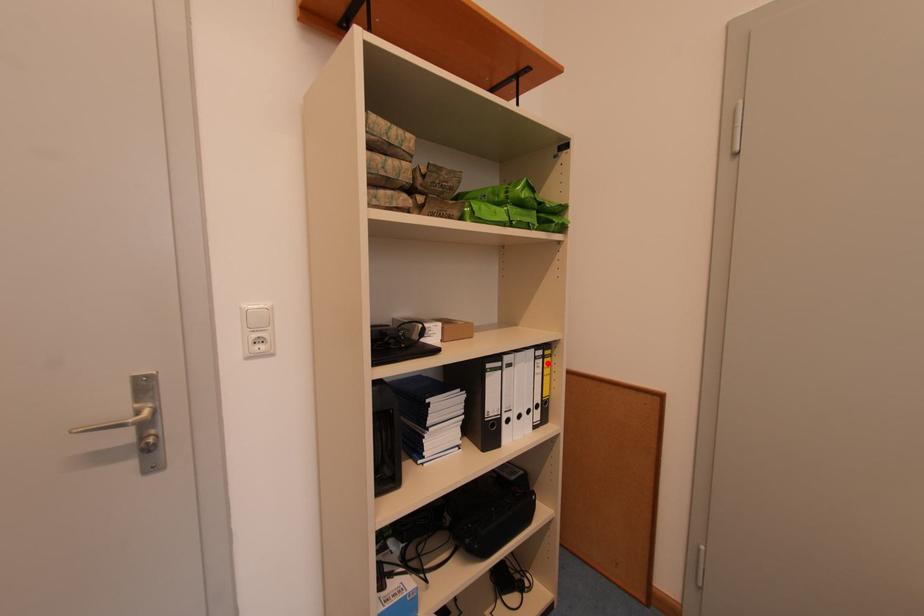
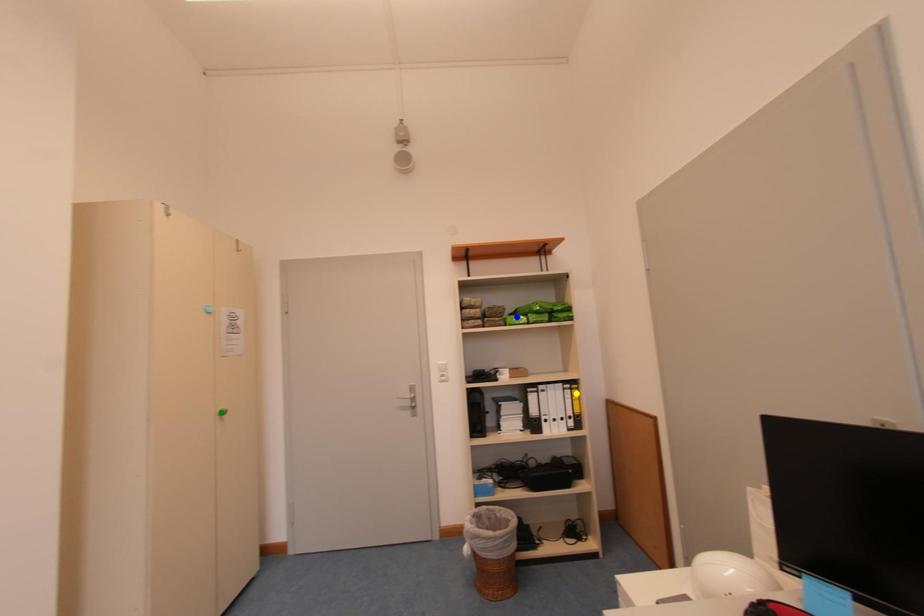
Question: I am providing you with two images of the same scene from different viewpoints. A red point is marked on the first image. You are given multiple points on the second image. Which point in image 2 represents the same 3d spot as the red point in image 1?

Choices:
 (A) green point
 (B) blue point
 (C) yellow point

Answer: (C)